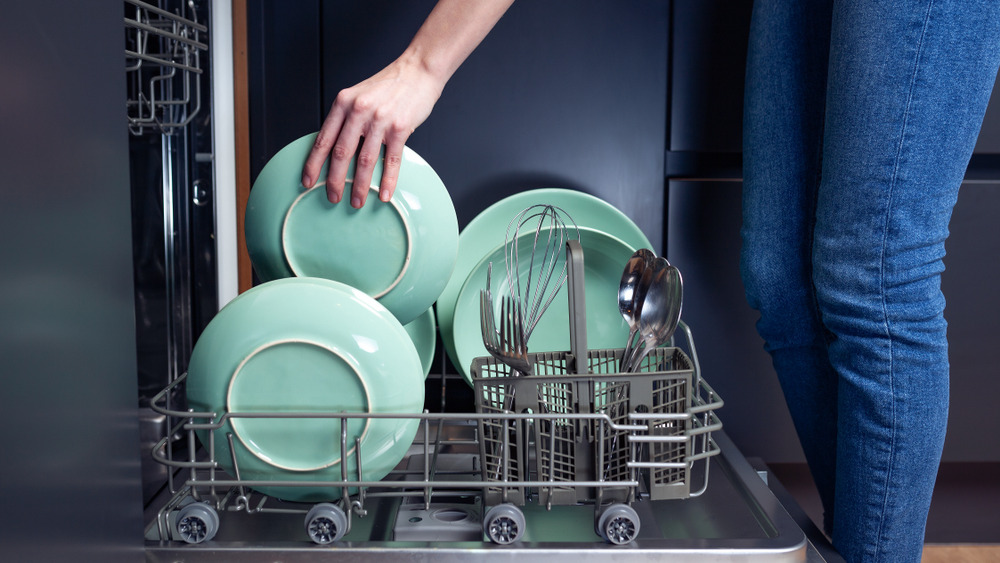
I want to click on plates, so click(320, 351), click(388, 253), click(486, 225), click(550, 326).